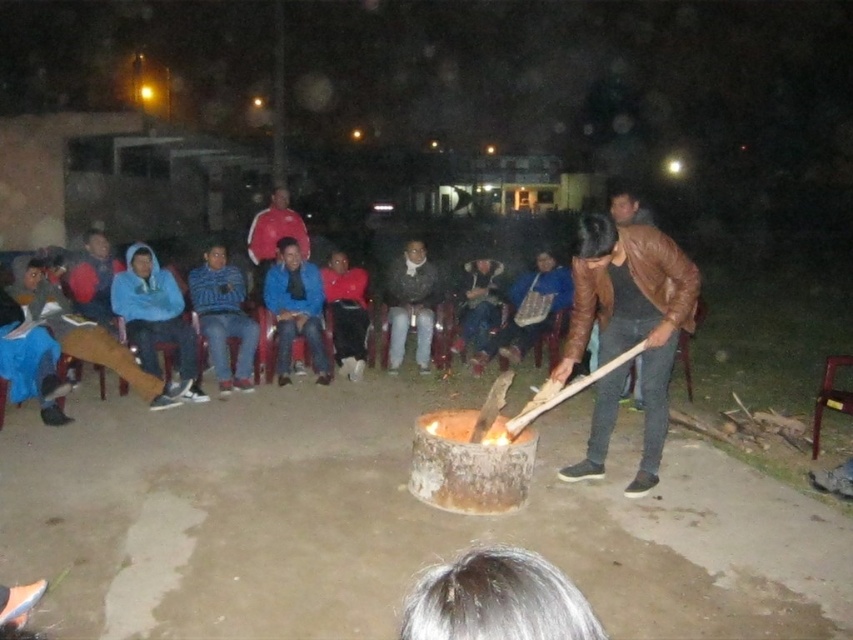
Is blue knitwear at center shorter than dark brown leather jacket at center?

Indeed, blue knitwear at center has a lesser height compared to dark brown leather jacket at center.

Can you confirm if blue knitwear at center is taller than dark brown leather jacket at center?

No.

I want to click on blue knitwear at center, so click(223, 317).

Is point (299, 312) more distant than point (393, 288)?

No, (299, 312) is in front of (393, 288).

Between blue fleece jacket at center and dark brown leather jacket at center, which one has more height?

Standing taller between the two is blue fleece jacket at center.

At what (x,y) coordinates should I click in order to perform the action: click on blue fleece jacket at center. Please return your answer as a coordinate pair (x, y). The width and height of the screenshot is (853, 640). Looking at the image, I should click on (294, 308).

What are the coordinates of `blue fleece jacket at center` in the screenshot? It's located at (294, 308).

In the scene shown: Is brown leather jacket at center in front of dark brown leather jacket at center?

That is True.

Does brown leather jacket at center appear on the right side of dark brown leather jacket at center?

Indeed, brown leather jacket at center is positioned on the right side of dark brown leather jacket at center.

The height and width of the screenshot is (640, 853). Describe the element at coordinates (631, 316) in the screenshot. I see `brown leather jacket at center` at that location.

Identify the location of brown leather jacket at center. This screenshot has height=640, width=853. (631, 316).